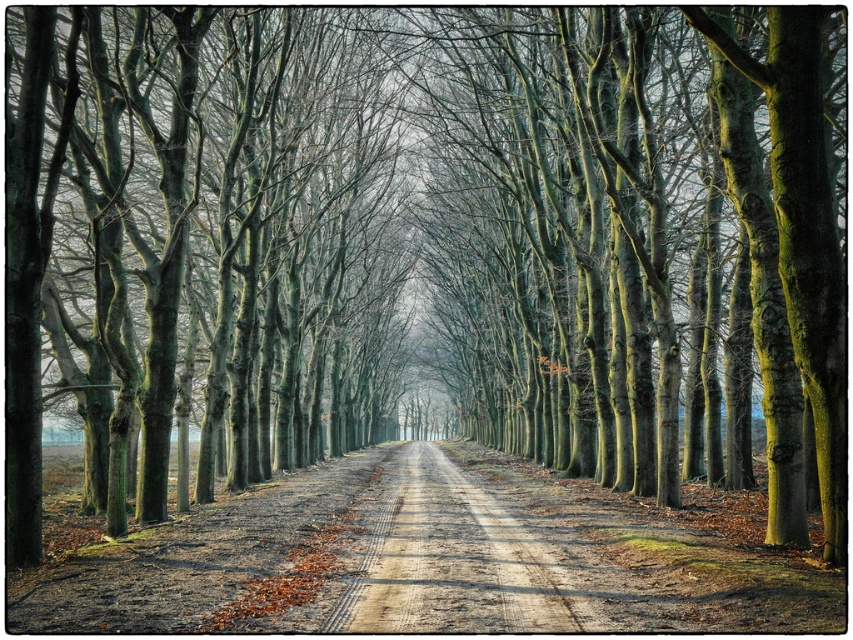
Question: Observing the image, what is the correct spatial positioning of smooth bark trees at center in reference to dirt road at center?

Choices:
 (A) left
 (B) right

Answer: (A)

Question: In this image, where is smooth bark trees at center located relative to dirt road at center?

Choices:
 (A) right
 (B) left

Answer: (B)

Question: Which point is farther to the camera?

Choices:
 (A) (519, 614)
 (B) (74, 49)

Answer: (B)

Question: Is smooth bark trees at center above dirt road at center?

Choices:
 (A) no
 (B) yes

Answer: (B)